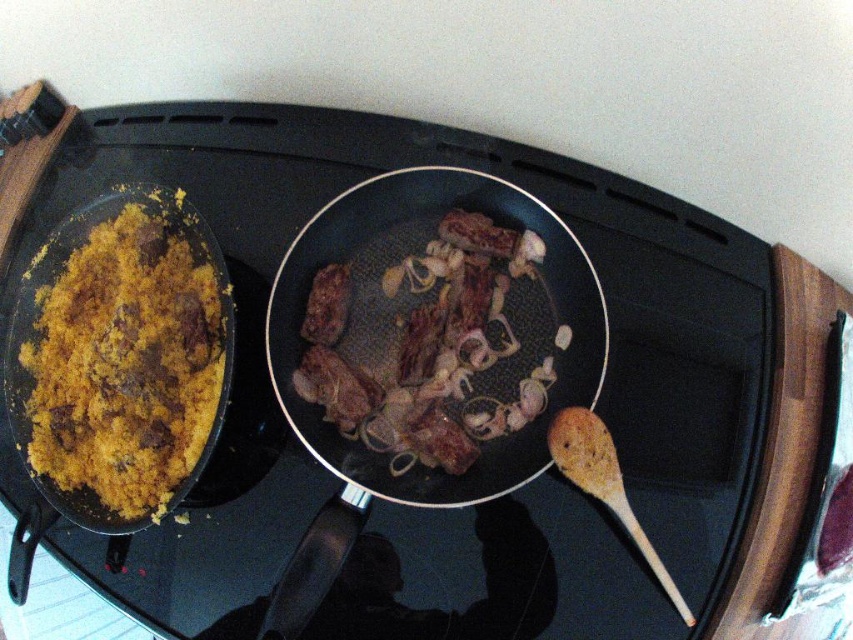
You are a chef preparing a dish and need to determine which item is taller between the brown matte meat at center and the wooden spoon at lower right. Based on the scene, which one is taller?

The brown matte meat at center is taller than the wooden spoon at lower right.

You are a chef preparing a dish and need to know which object is wider. You see the brown matte meat at center and the wooden spoon at lower right. Which one is wider?

The brown matte meat at center is wider than the wooden spoon at lower right according to the description.